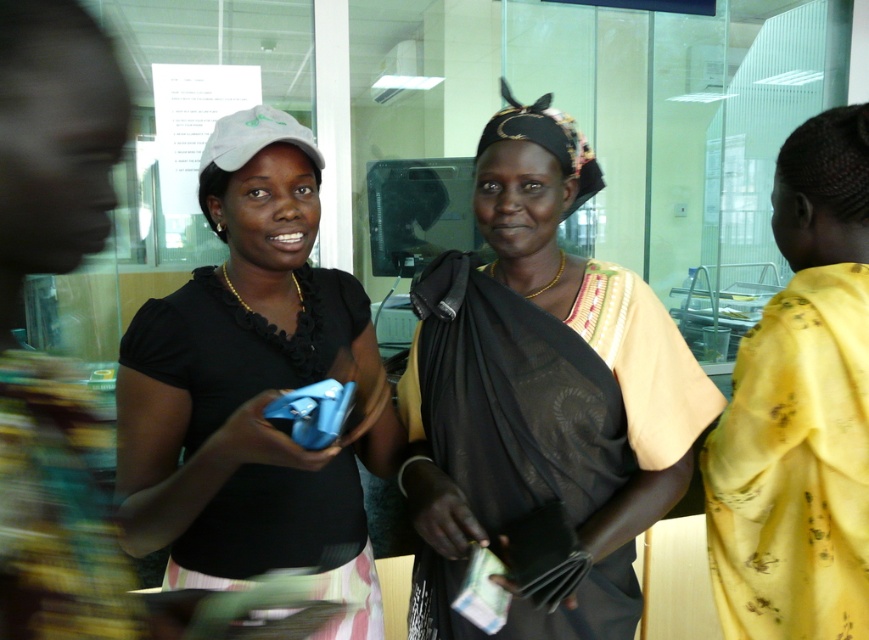
Does black textured scarf at center have a greater height compared to matte black shirt at center?

Correct, black textured scarf at center is much taller as matte black shirt at center.

Is black textured scarf at center wider than matte black shirt at center?

Yes.

Find the location of a particular element. black textured scarf at center is located at coordinates pos(541,396).

Where is `black textured scarf at center`? black textured scarf at center is located at coordinates (541, 396).